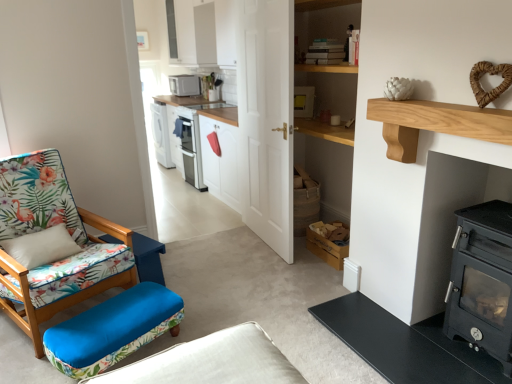
Find the location of a particular element. Image resolution: width=512 pixels, height=384 pixels. free point above blue floral fabric studio couch at lower left (from a real-world perspective) is located at coordinates (203, 365).